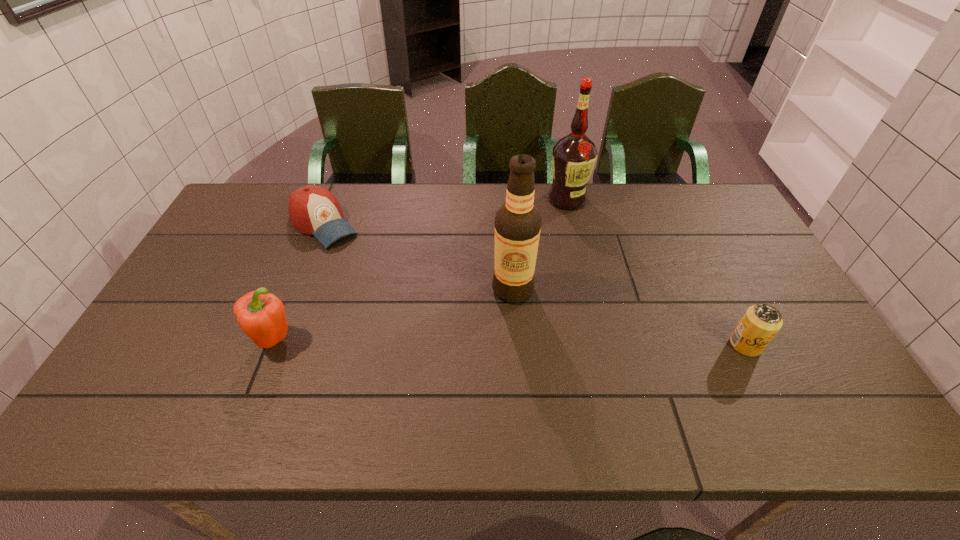
The image size is (960, 540). I want to click on free space on the desktop that is between the third shortest object and the beer can and is positioned on the label of the third object from left to right, so click(x=470, y=342).

Find the location of a particular element. The image size is (960, 540). free space on the desktop that is between the pepper and the beer can and is positioned on the front-facing side of the baseball cap is located at coordinates (444, 342).

Find the location of a particular element. This screenshot has height=540, width=960. free spot on the desktop that is between the third shortest object and the beer can and is positioned on the label of the second object from right to left is located at coordinates (540, 343).